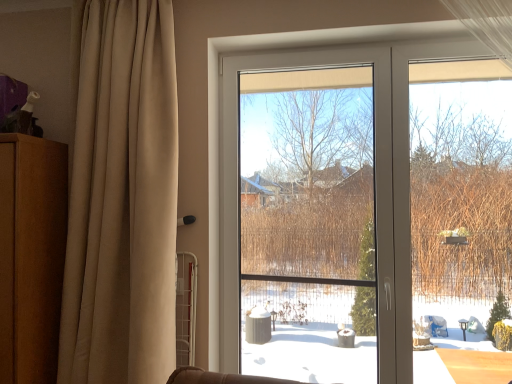
Question: Is transparent plastic window screen at center bigger than brown wood dresser at left?

Choices:
 (A) yes
 (B) no

Answer: (B)

Question: Considering the relative sizes of transparent plastic window screen at center and brown wood dresser at left in the image provided, is transparent plastic window screen at center shorter than brown wood dresser at left?

Choices:
 (A) no
 (B) yes

Answer: (A)

Question: From the image's perspective, would you say transparent plastic window screen at center is shown under brown wood dresser at left?

Choices:
 (A) yes
 (B) no

Answer: (B)

Question: Is transparent plastic window screen at center turned away from brown wood dresser at left?

Choices:
 (A) no
 (B) yes

Answer: (A)

Question: Can you see transparent plastic window screen at center touching brown wood dresser at left?

Choices:
 (A) no
 (B) yes

Answer: (A)

Question: In terms of height, does transparent plastic window screen at center look taller or shorter compared to beige fabric curtain at left?

Choices:
 (A) tall
 (B) short

Answer: (B)

Question: Relative to beige fabric curtain at left, is transparent plastic window screen at center in front or behind?

Choices:
 (A) behind
 (B) front

Answer: (A)

Question: From the image's perspective, is transparent plastic window screen at center positioned above or below beige fabric curtain at left?

Choices:
 (A) above
 (B) below

Answer: (B)

Question: Based on their positions, is transparent plastic window screen at center located to the left or right of beige fabric curtain at left?

Choices:
 (A) left
 (B) right

Answer: (B)

Question: Would you say beige fabric curtain at left is inside or outside transparent plastic window screen at center?

Choices:
 (A) inside
 (B) outside

Answer: (B)

Question: Is beige fabric curtain at left bigger or smaller than transparent plastic window screen at center?

Choices:
 (A) big
 (B) small

Answer: (A)

Question: From the image's perspective, is beige fabric curtain at left positioned above or below transparent plastic window screen at center?

Choices:
 (A) below
 (B) above

Answer: (B)

Question: Considering their positions, is beige fabric curtain at left located in front of or behind transparent plastic window screen at center?

Choices:
 (A) behind
 (B) front

Answer: (B)

Question: From a real-world perspective, is brown wood dresser at left above or below beige fabric curtain at left?

Choices:
 (A) below
 (B) above

Answer: (A)

Question: From the image's perspective, relative to beige fabric curtain at left, is brown wood dresser at left above or below?

Choices:
 (A) below
 (B) above

Answer: (A)